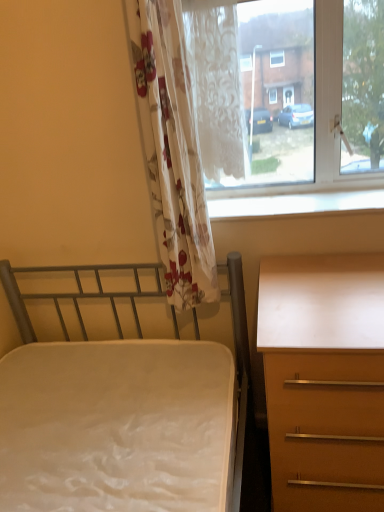
Question: Does floral fabric curtain at left, marked as the first curtain in a left-to-right arrangement, have a smaller size compared to matte brown desk at right?

Choices:
 (A) no
 (B) yes

Answer: (B)

Question: From a real-world perspective, is floral fabric curtain at left, marked as the first curtain in a left-to-right arrangement, positioned under matte brown desk at right based on gravity?

Choices:
 (A) yes
 (B) no

Answer: (B)

Question: Does floral fabric curtain at left, marked as the first curtain in a left-to-right arrangement, touch matte brown desk at right?

Choices:
 (A) yes
 (B) no

Answer: (B)

Question: Would you say matte brown desk at right is part of floral fabric curtain at left, marked as the second curtain in a right-to-left arrangement,'s contents?

Choices:
 (A) no
 (B) yes

Answer: (A)

Question: From a real-world perspective, is floral fabric curtain at left, marked as the first curtain in a left-to-right arrangement, located higher than matte brown desk at right?

Choices:
 (A) yes
 (B) no

Answer: (A)

Question: From the image's perspective, is floral fabric curtain at left, marked as the first curtain in a left-to-right arrangement, over matte brown desk at right?

Choices:
 (A) no
 (B) yes

Answer: (B)

Question: From the image's perspective, does transparent glass window at upper right appear higher than matte brown desk at right?

Choices:
 (A) no
 (B) yes

Answer: (B)

Question: Is matte brown desk at right at the back of transparent glass window at upper right?

Choices:
 (A) no
 (B) yes

Answer: (A)

Question: From the image's perspective, would you say transparent glass window at upper right is shown under matte brown desk at right?

Choices:
 (A) no
 (B) yes

Answer: (A)

Question: Is transparent glass window at upper right directly adjacent to matte brown desk at right?

Choices:
 (A) no
 (B) yes

Answer: (A)

Question: Is matte brown desk at right located within transparent glass window at upper right?

Choices:
 (A) yes
 (B) no

Answer: (B)

Question: Is transparent glass window at upper right not close to matte brown desk at right?

Choices:
 (A) yes
 (B) no

Answer: (B)

Question: Is white glossy window sill at upper center surrounded by metallic gray bed at left?

Choices:
 (A) yes
 (B) no

Answer: (B)